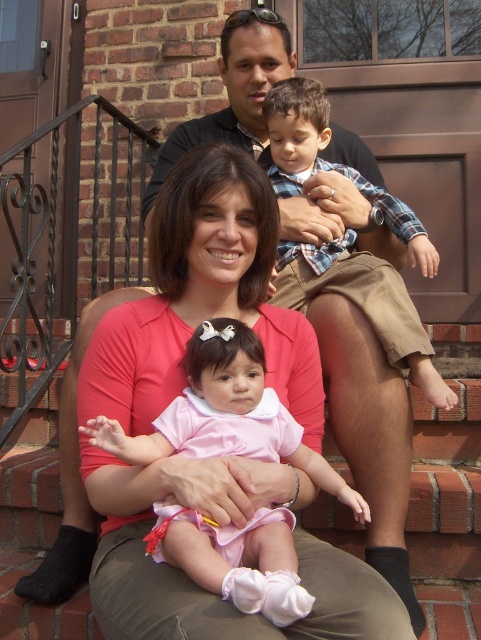
Question: Can you confirm if pink satin dress at center is positioned below plaid cotton shirt at upper right?

Choices:
 (A) no
 (B) yes

Answer: (B)

Question: Which point is closer to the camera taking this photo?

Choices:
 (A) (443, 396)
 (B) (201, 576)

Answer: (B)

Question: Does pink satin dress at center appear under plaid cotton shirt at upper right?

Choices:
 (A) no
 (B) yes

Answer: (B)

Question: Is pink satin dress at center wider than plaid cotton shirt at upper right?

Choices:
 (A) yes
 (B) no

Answer: (A)